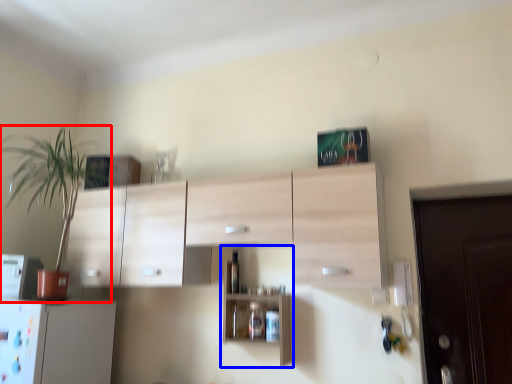
Question: Which object appears farthest to the camera in this image, houseplant (highlighted by a red box) or shelf (highlighted by a blue box)?

Choices:
 (A) houseplant
 (B) shelf

Answer: (B)